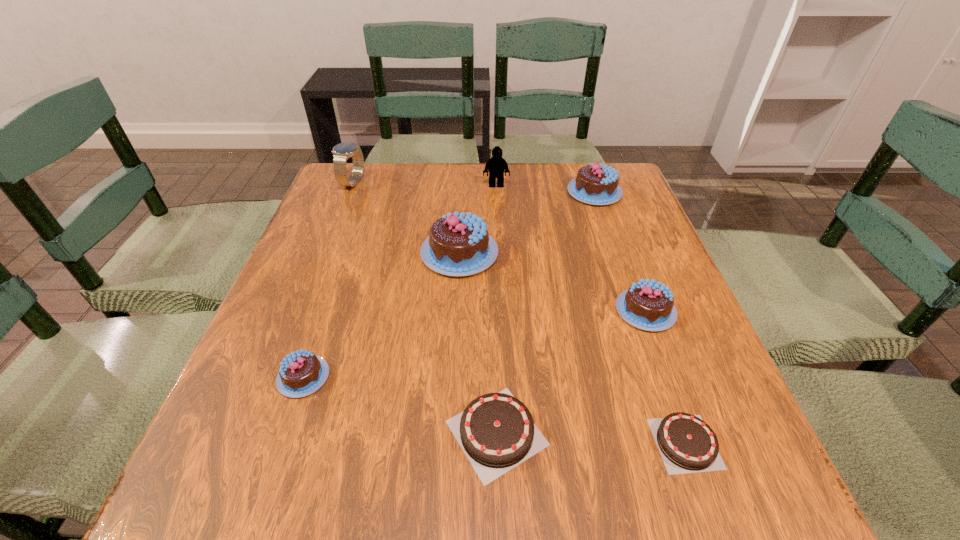
Where is `vacant area that lies between the fifth shortest object and the fourth nearest chocolate cake`? Image resolution: width=960 pixels, height=540 pixels. vacant area that lies between the fifth shortest object and the fourth nearest chocolate cake is located at coordinates (620, 252).

I want to click on free area in between the fifth nearest object and the watch, so click(406, 218).

Where is `vacant region between the black Lego and the watch`? The width and height of the screenshot is (960, 540). vacant region between the black Lego and the watch is located at coordinates (424, 184).

This screenshot has width=960, height=540. Find the location of `vacant area that lies between the right brown chocolate cake and the second farthest chocolate cake`. vacant area that lies between the right brown chocolate cake and the second farthest chocolate cake is located at coordinates (572, 348).

Where is `unoccupied area between the Lego and the left brown chocolate cake`? This screenshot has width=960, height=540. unoccupied area between the Lego and the left brown chocolate cake is located at coordinates (496, 309).

Identify the location of object that stands as the closest to the fourth tallest object. The width and height of the screenshot is (960, 540). (496, 166).

Locate which object ranks fifth in proximity to the blue watch. Please provide its 2D coordinates. Your answer should be formatted as a tuple, i.e. [(x, y)], where the tuple contains the x and y coordinates of a point satisfying the conditions above.

[(496, 431)]

Identify which chocolate cake is the fourth nearest to the blue watch. Please provide its 2D coordinates. Your answer should be formatted as a tuple, i.e. [(x, y)], where the tuple contains the x and y coordinates of a point satisfying the conditions above.

[(496, 431)]

Locate an element on the screen. the sixth closest chocolate cake relative to the blue watch is located at coordinates (687, 444).

Locate an element on the screen. Image resolution: width=960 pixels, height=540 pixels. the third closest pink chocolate cake to the shortest chocolate cake is located at coordinates (301, 373).